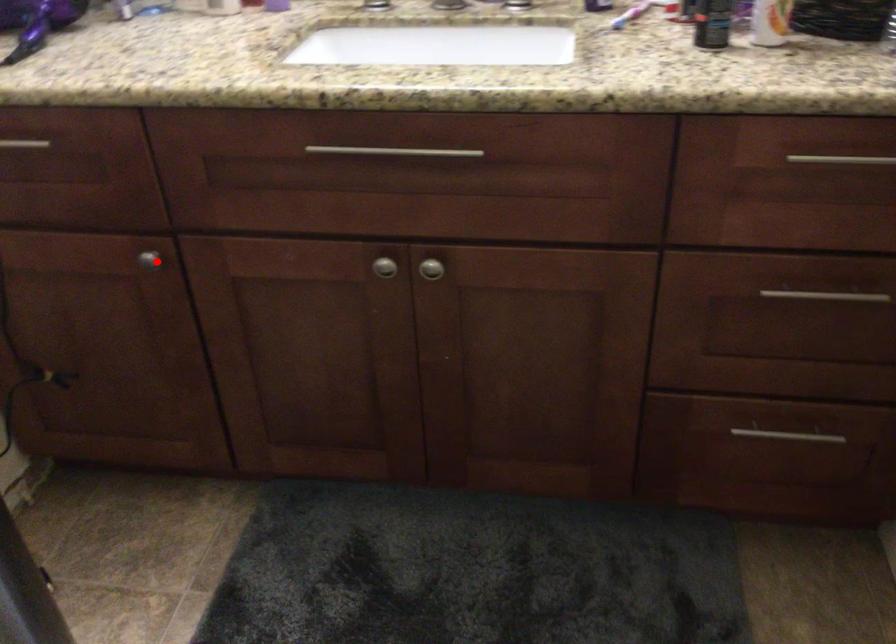
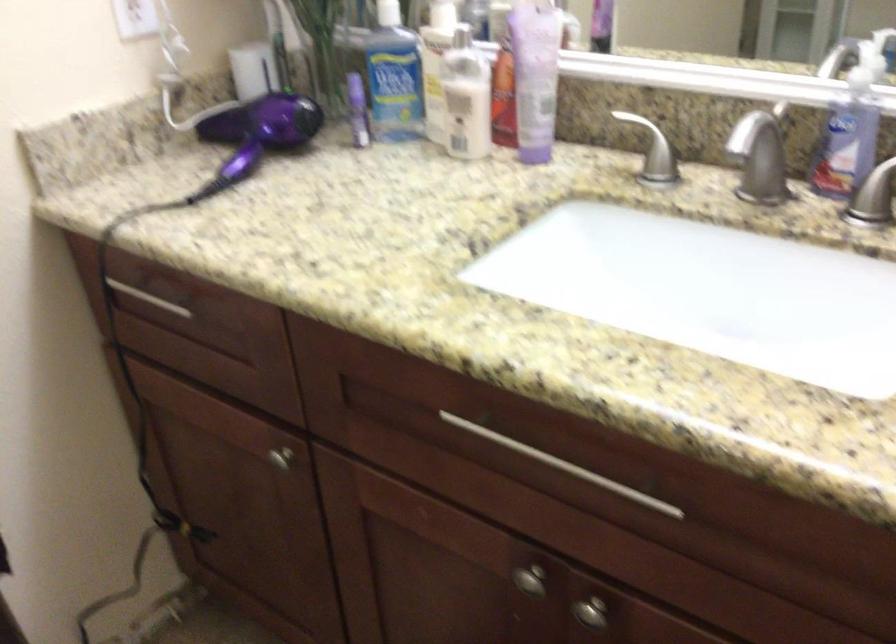
Question: I am providing you with two images of the same scene from different viewpoints. Given a red point in image1, look at the same physical point in image2. Is it:

Choices:
 (A) Closer to the viewpoint
 (B) Farther from the viewpoint

Answer: (A)